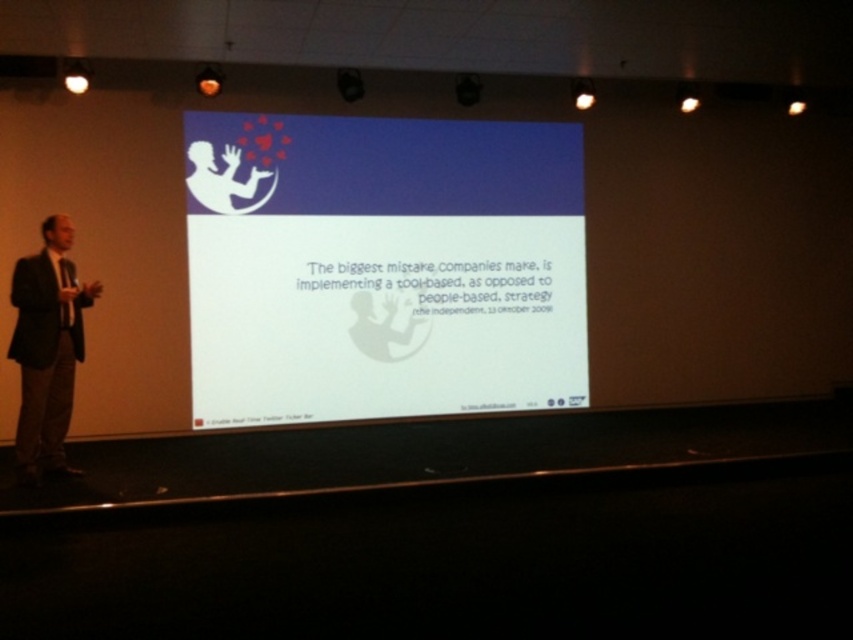
You are an attendee at the presentation and need to take a photo of the white matte projection screen at center. The camera you are using has a fixed focus set at point 0.45, 0.45. Will the screen be in focus?

The white matte projection screen at center is located at point (381,268), which is very close to the camera focus point at (383,288). Therefore, the screen should be in focus.

You are an event planner setting up the stage for a presentation. You need to ensure that the white matte projection screen at center and the dark suit at left are positioned correctly. Based on the scene description, which object is placed higher in the image?

The white matte projection screen at center is located above the dark suit at left, so it is placed higher in the image.